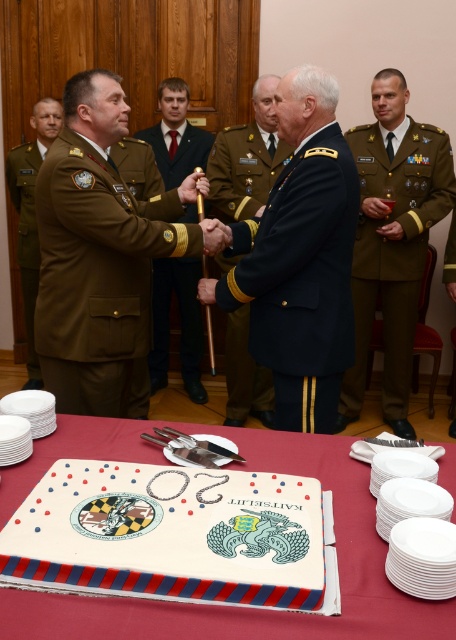
Can you confirm if white fondant cake at center is bigger than satin brown uniform at center?

No.

Which is above, white fondant cake at center or satin brown uniform at center?

Positioned higher is satin brown uniform at center.

Is point (103, 570) farther from camera compared to point (187, 349)?

No, (103, 570) is in front of (187, 349).

Where is `white fondant cake at center`? The image size is (456, 640). white fondant cake at center is located at coordinates (170, 534).

Does satin brown uniform at center have a lesser width compared to olive green fabric uniform at left?

No.

In the scene shown: How much distance is there between satin brown uniform at center and olive green fabric uniform at left?

A distance of 31.66 inches exists between satin brown uniform at center and olive green fabric uniform at left.

Who is more distant from viewer, (167,285) or (24,218)?

Positioned behind is point (167,285).

The image size is (456, 640). I want to click on satin brown uniform at center, so click(x=181, y=324).

Which is more to the left, navy blue uniform at center or satin brown uniform at center?

satin brown uniform at center

At what (x,y) coordinates should I click in order to perform the action: click on navy blue uniform at center. Please return your answer as a coordinate pair (x, y). The width and height of the screenshot is (456, 640). Looking at the image, I should click on (248, 157).

The width and height of the screenshot is (456, 640). In order to click on navy blue uniform at center in this screenshot , I will do `click(248, 157)`.